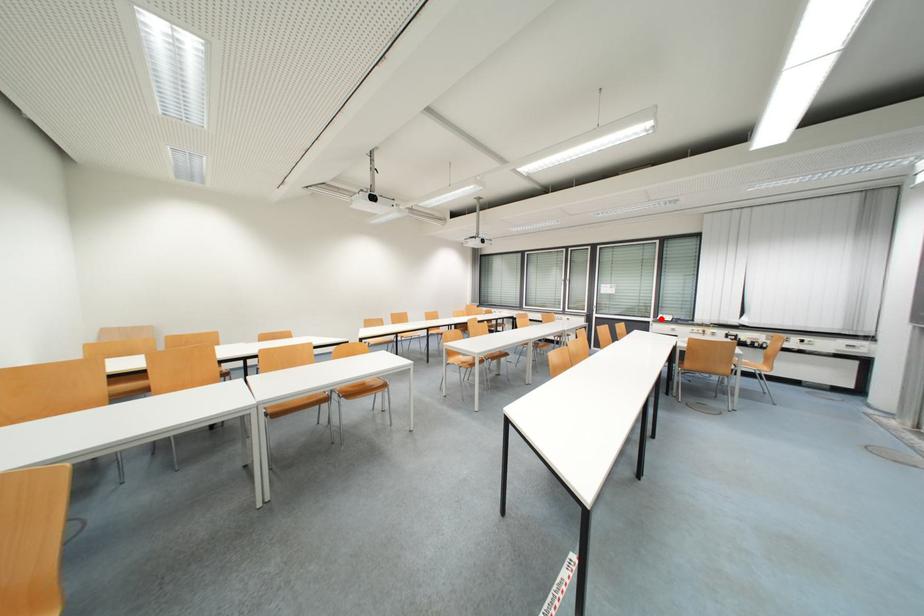
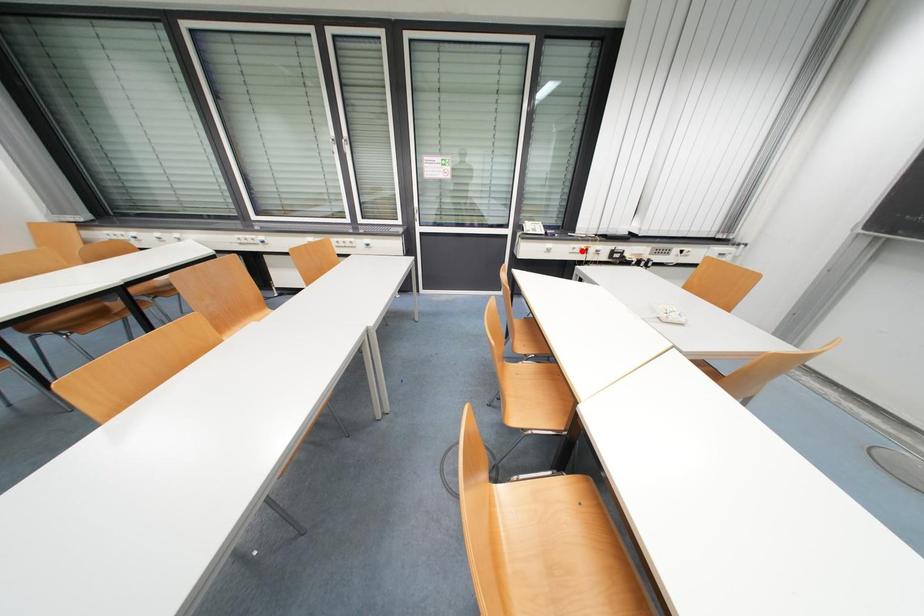
I am providing you with two images of the same scene from different viewpoints. A red point is marked on the first image and another point is marked on the second image. Is the marked point in image1 the same physical position as the marked point in image2?

No